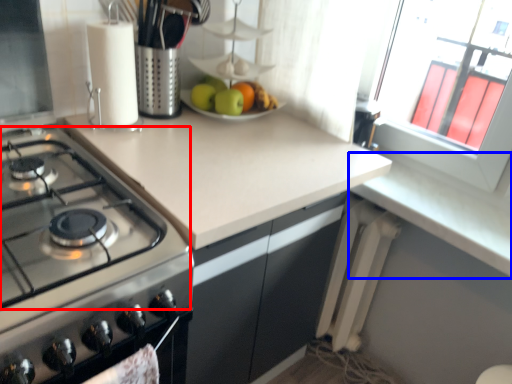
Question: Among these objects, which one is nearest to the camera, gas stove (highlighted by a red box) or counter top (highlighted by a blue box)?

Choices:
 (A) gas stove
 (B) counter top

Answer: (A)